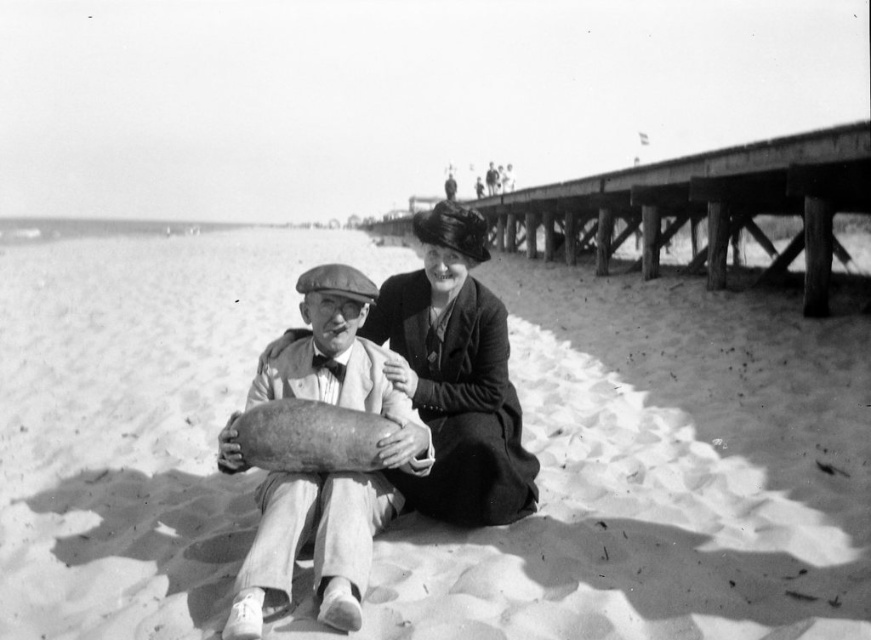
Question: Is smooth sand at center to the right of smooth fabric dress at center from the viewer's perspective?

Choices:
 (A) yes
 (B) no

Answer: (B)

Question: Considering the real-world distances, which object is farthest from the wooden pier at upper right?

Choices:
 (A) smooth wooden cylinder at center
 (B) smooth fabric dress at center
 (C) smooth sand at center

Answer: (B)

Question: Which point is closer to the camera?

Choices:
 (A) (714, 497)
 (B) (467, 220)
 (C) (261, 528)

Answer: (C)

Question: Can you confirm if wooden pier at upper right is positioned above smooth fabric dress at center?

Choices:
 (A) yes
 (B) no

Answer: (A)

Question: Which point is closer to the camera?

Choices:
 (A) smooth sand at center
 (B) smooth fabric dress at center
 (C) smooth wooden cylinder at center

Answer: (C)

Question: Does wooden pier at upper right come behind smooth fabric dress at center?

Choices:
 (A) no
 (B) yes

Answer: (B)